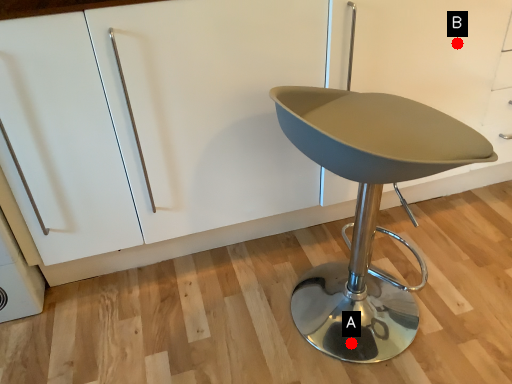
Question: Two points are circled on the image, labeled by A and B beside each circle. Which point is closer to the camera?

Choices:
 (A) A is closer
 (B) B is closer

Answer: (A)